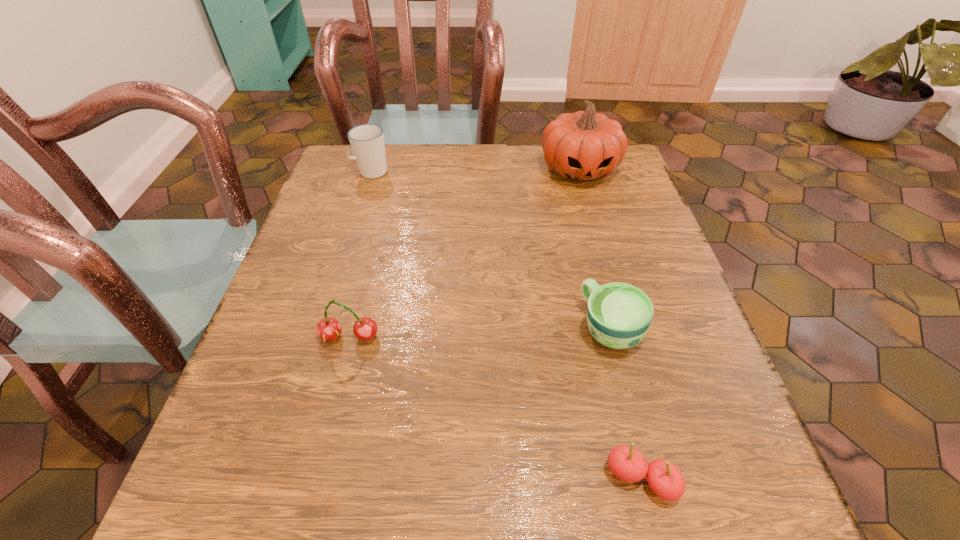
Locate an element on the screen. The width and height of the screenshot is (960, 540). free space that satisfies the following two spatial constraints: 1. with stems pointing upwards on the left cherry; 2. on the right side of the nearest object is located at coordinates (314, 480).

This screenshot has width=960, height=540. I want to click on free point that satisfies the following two spatial constraints: 1. with stems pointing upwards on the farther cherry; 2. on the left side of the shorter cherry, so click(314, 480).